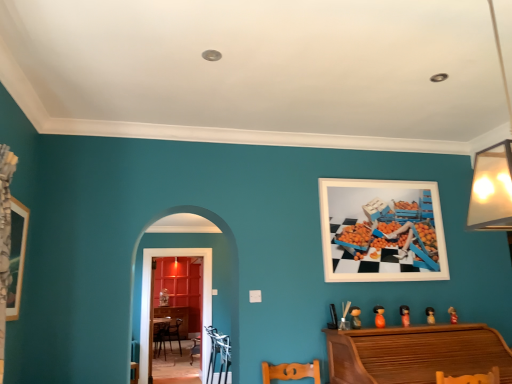
What do you see at coordinates (160, 335) in the screenshot? The image size is (512, 384). I see `wooden table at center` at bounding box center [160, 335].

The image size is (512, 384). I want to click on metallic silver armchair at lower center, so click(223, 355).

The image size is (512, 384). What do you see at coordinates (453, 315) in the screenshot?
I see `matte orange figurine at lower right, the 5th toy when ordered from left to right` at bounding box center [453, 315].

In order to click on orange matte toy at lower right, which is the 4th toy from right to left in this screenshot , I will do click(379, 316).

What is the approximate height of orange matte toy at lower right, which is the 4th toy from right to left?

orange matte toy at lower right, which is the 4th toy from right to left, is 6.57 inches tall.

What do you see at coordinates (17, 256) in the screenshot? I see `wooden picture frame at left, which is the first picture frame in left-to-right order` at bounding box center [17, 256].

At what (x,y) coordinates should I click in order to perform the action: click on white matte picture frame at upper right, marked as the first picture frame in a right-to-left arrangement. Please return your answer as a coordinate pair (x, y). Image resolution: width=512 pixels, height=384 pixels. Looking at the image, I should click on (382, 231).

Is wooden table at center positioned with its back to white matte picture frame at upper right, arranged as the first picture frame when viewed from the back?

No, wooden table at center is not facing away from white matte picture frame at upper right, arranged as the first picture frame when viewed from the back.

Which is in front, point (164, 331) or point (367, 271)?

The point (367, 271) is in front.

From a real-world perspective, who is located lower, wooden table at center or white matte picture frame at upper right, the 2th picture frame from the front?

wooden table at center, from a real-world perspective.

Is wooden table at center thinner than white matte picture frame at upper right, the 2th picture frame from the front?

Incorrect, the width of wooden table at center is not less than that of white matte picture frame at upper right, the 2th picture frame from the front.

Is orange matte doll at lower right, which is counted as the third toy, starting from the left, positioned in front of wooden dresser at center?

Yes, orange matte doll at lower right, which is counted as the third toy, starting from the left, is closer to the viewer.

Image resolution: width=512 pixels, height=384 pixels. In order to click on dresser below the orange matte doll at lower right, which is counted as the third toy, starting from the left (from the image's perspective) in this screenshot , I will do `click(179, 289)`.

Can you confirm if orange matte doll at lower right, which is counted as the third toy, starting from the left, is smaller than wooden dresser at center?

Indeed, orange matte doll at lower right, which is counted as the third toy, starting from the left, has a smaller size compared to wooden dresser at center.

From the image's perspective, is orange matte doll at lower right, which is counted as the third toy, starting from the left, over wooden dresser at center?

Yes, from the image's perspective, orange matte doll at lower right, which is counted as the third toy, starting from the left, is over wooden dresser at center.

Is matte orange figurine at lower right, the 1th toy viewed from the right, oriented towards wooden picture frame at left, acting as the second picture frame starting from the right?

No, matte orange figurine at lower right, the 1th toy viewed from the right, is not turned towards wooden picture frame at left, acting as the second picture frame starting from the right.

From the image's perspective, is matte orange figurine at lower right, the 1th toy viewed from the right, on wooden picture frame at left, which is the first picture frame in left-to-right order?

No.

How distant is matte orange figurine at lower right, the 5th toy when ordered from left to right, from wooden picture frame at left, which is the first picture frame in left-to-right order?

matte orange figurine at lower right, the 5th toy when ordered from left to right, and wooden picture frame at left, which is the first picture frame in left-to-right order, are 3.17 meters apart from each other.

Is matte orange figurine at lower right, the 5th toy when ordered from left to right, spatially inside wooden picture frame at left, acting as the second picture frame starting from the right, or outside of it?

matte orange figurine at lower right, the 5th toy when ordered from left to right, cannot be found inside wooden picture frame at left, acting as the second picture frame starting from the right.

Who is bigger, wooden dresser at center or matte wooden doll at lower center, arranged as the 5th toy when viewed from the right?

Bigger between the two is wooden dresser at center.

From a real-world perspective, does wooden dresser at center stand above matte wooden doll at lower center, arranged as the 5th toy when viewed from the right?

No, from a real-world perspective, wooden dresser at center is not on top of matte wooden doll at lower center, arranged as the 5th toy when viewed from the right.

Is wooden dresser at center with matte wooden doll at lower center, arranged as the 5th toy when viewed from the right?

There is a gap between wooden dresser at center and matte wooden doll at lower center, arranged as the 5th toy when viewed from the right.

Is wooden dresser at center looking in the opposite direction of matte wooden doll at lower center, which appears as the 1th toy when viewed from the left?

No.

Could you measure the distance between matte orange figurine at lower right, the 1th toy viewed from the right, and wooden table at center?

The distance of matte orange figurine at lower right, the 1th toy viewed from the right, from wooden table at center is 4.21 meters.

From their relative heights in the image, would you say matte orange figurine at lower right, the 1th toy viewed from the right, is taller or shorter than wooden table at center?

matte orange figurine at lower right, the 1th toy viewed from the right, is shorter than wooden table at center.

Is wooden table at center surrounded by matte orange figurine at lower right, the 1th toy viewed from the right?

No, matte orange figurine at lower right, the 1th toy viewed from the right, does not contain wooden table at center.

Between matte orange figurine at lower right, the 5th toy when ordered from left to right, and wooden table at center, which one has larger width?

wooden table at center is wider.

Between metallic silver armchair at lower center and wooden table at center, which one has smaller size?

Smaller between the two is metallic silver armchair at lower center.

Is metallic silver armchair at lower center in front of wooden table at center?

Yes.

Which object is thinner, metallic silver armchair at lower center or wooden table at center?

metallic silver armchair at lower center is thinner.

Can you confirm if metallic silver armchair at lower center is taller than wooden table at center?

No, metallic silver armchair at lower center is not taller than wooden table at center.

Would you say matte orange figurine at lower right, the 2th toy viewed from the right, contains matte wooden doll at lower center, arranged as the 5th toy when viewed from the right?

Answer: Definitely not — matte wooden doll at lower center, arranged as the 5th toy when viewed from the right, is not inside matte orange figurine at lower right, the 2th toy viewed from the right.

What's the angular difference between matte orange figurine at lower right, the 2th toy viewed from the right, and matte wooden doll at lower center, arranged as the 5th toy when viewed from the right,'s facing directions?

The facing directions of matte orange figurine at lower right, the 2th toy viewed from the right, and matte wooden doll at lower center, arranged as the 5th toy when viewed from the right, are 0.223 degrees apart.

Where is `the 3rd toy to the left when counting from the matte orange figurine at lower right, which is the fourth toy from left to right`? the 3rd toy to the left when counting from the matte orange figurine at lower right, which is the fourth toy from left to right is located at coordinates (355, 317).

Is point (428, 309) less distant than point (353, 306)?

No, (428, 309) is behind (353, 306).

The image size is (512, 384). I want to click on table behind the white matte picture frame at upper right, marked as the first picture frame in a right-to-left arrangement, so [x=160, y=335].

Where is `dresser on the left side of orange matte doll at lower right, which is the 3th toy from right to left`? dresser on the left side of orange matte doll at lower right, which is the 3th toy from right to left is located at coordinates (179, 289).

When comparing their distances from metallic silver armchair at lower center, does wooden table at center or wooden picture frame at left, the 1th picture frame from the front, seem further?

The object further to metallic silver armchair at lower center is wooden table at center.

Based on their spatial positions, is orange matte doll at lower right, which is counted as the third toy, starting from the left, or wooden table at center closer to white matte picture frame at upper right, arranged as the first picture frame when viewed from the back?

Based on the image, orange matte doll at lower right, which is counted as the third toy, starting from the left, appears to be nearer to white matte picture frame at upper right, arranged as the first picture frame when viewed from the back.

Considering their positions, is matte orange figurine at lower right, which is the fourth toy from left to right, positioned further to matte wooden doll at lower center, which appears as the 1th toy when viewed from the left, than wooden table at center?

The object further to matte wooden doll at lower center, which appears as the 1th toy when viewed from the left, is wooden table at center.

From the image, which object appears to be farther from orange matte toy at lower right, the 2th toy viewed from the left, orange matte doll at lower right, which is counted as the third toy, starting from the left, or wooden table at center?

Based on the image, wooden table at center appears to be further to orange matte toy at lower right, the 2th toy viewed from the left.

Based on their spatial positions, is orange matte toy at lower right, the 2th toy viewed from the left, or wooden table at center further from wooden dresser at center?

orange matte toy at lower right, the 2th toy viewed from the left, lies further to wooden dresser at center than the other object.

Based on their spatial positions, is wooden picture frame at left, the 2th picture frame from the back, or matte orange figurine at lower right, the 5th toy when ordered from left to right, further from wooden dresser at center?

matte orange figurine at lower right, the 5th toy when ordered from left to right, is positioned further to the anchor wooden dresser at center.

Which object lies further to the anchor point wooden dresser at center, wooden picture frame at left, acting as the second picture frame starting from the right, or wooden table at center?

The object further to wooden dresser at center is wooden picture frame at left, acting as the second picture frame starting from the right.

Based on their spatial positions, is white matte picture frame at upper right, the 2th picture frame from the front, or wooden piano at lower right further from wooden dresser at center?

Among the two, wooden piano at lower right is located further to wooden dresser at center.

Locate an element on the screen. Image resolution: width=512 pixels, height=384 pixels. toy between wooden picture frame at left, the 1th picture frame from the front, and orange matte toy at lower right, the 2th toy viewed from the left is located at coordinates 355,317.

This screenshot has width=512, height=384. I want to click on armchair between wooden picture frame at left, which is the first picture frame in left-to-right order, and orange matte doll at lower right, which is the 3th toy from right to left, in the horizontal direction, so click(x=223, y=355).

The height and width of the screenshot is (384, 512). Identify the location of armchair between wooden picture frame at left, which is the first picture frame in left-to-right order, and wooden table at center, along the z-axis. (223, 355).

I want to click on toy between orange matte toy at lower right, which is the 4th toy from right to left, and matte orange figurine at lower right, which is the fourth toy from left to right, so click(x=405, y=315).